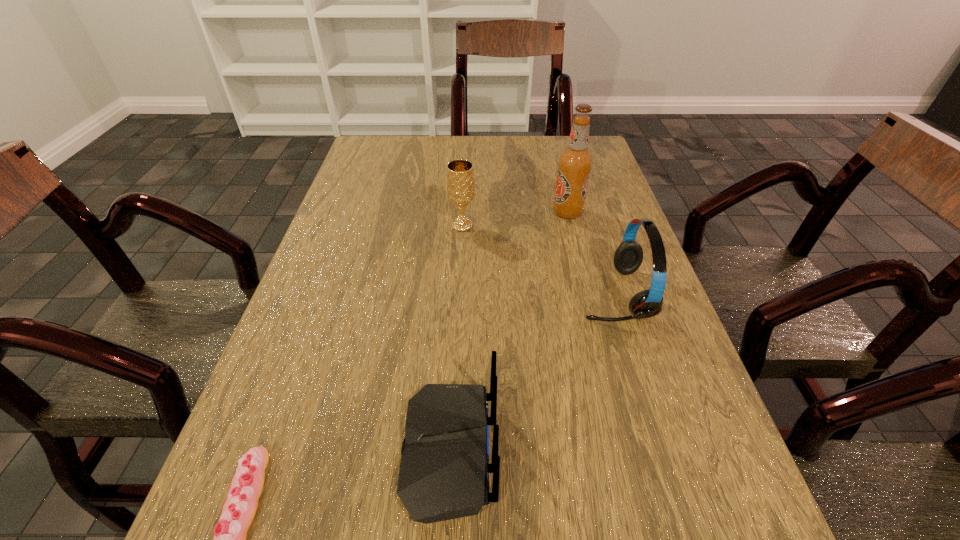
The width and height of the screenshot is (960, 540). What are the coordinates of `vacant region between the third nearest object and the chalice` in the screenshot? It's located at point(538,260).

The width and height of the screenshot is (960, 540). In order to click on free area in between the chalice and the headset in this screenshot , I will do `click(538, 260)`.

Locate an element on the screen. Image resolution: width=960 pixels, height=540 pixels. free spot between the chalice and the router is located at coordinates (456, 339).

This screenshot has width=960, height=540. I want to click on unoccupied area between the tallest object and the third nearest object, so click(x=590, y=253).

Where is `free space between the chalice and the tallest object`? This screenshot has width=960, height=540. free space between the chalice and the tallest object is located at coordinates (515, 219).

The height and width of the screenshot is (540, 960). In order to click on empty location between the beer bottle and the chalice in this screenshot , I will do `click(515, 219)`.

Identify which object is the nearest to the beer bottle. Please provide its 2D coordinates. Your answer should be formatted as a tuple, i.e. [(x, y)], where the tuple contains the x and y coordinates of a point satisfying the conditions above.

[(628, 257)]

Identify which object is the second nearest to the tallest object. Please provide its 2D coordinates. Your answer should be formatted as a tuple, i.e. [(x, y)], where the tuple contains the x and y coordinates of a point satisfying the conditions above.

[(460, 177)]